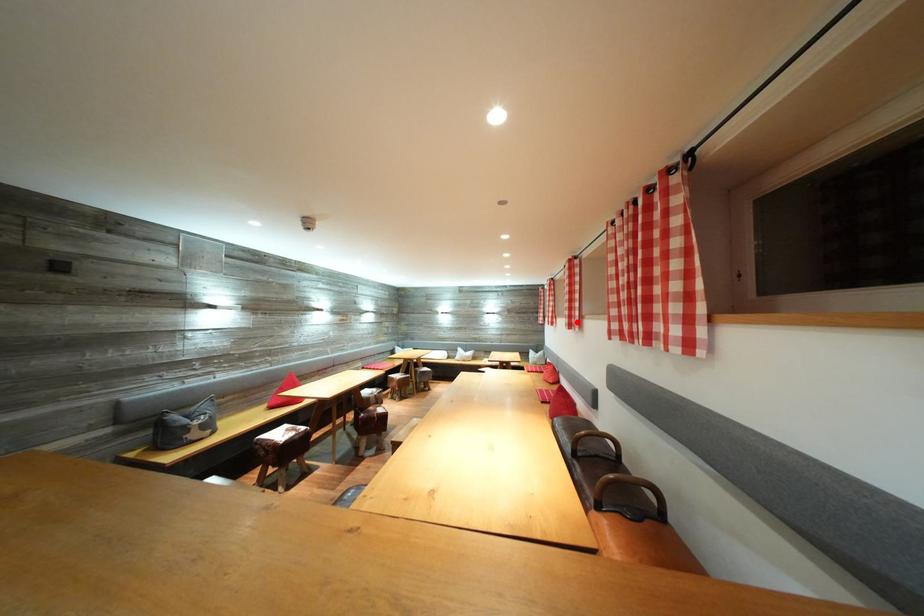
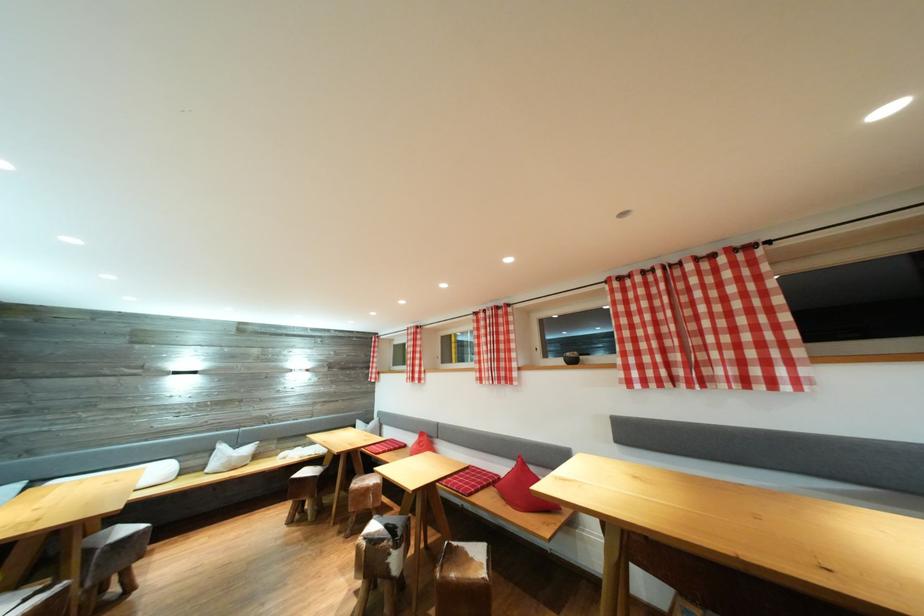
Where in the second image is the point corresponding to the highlighted location from the first image?

(505, 374)